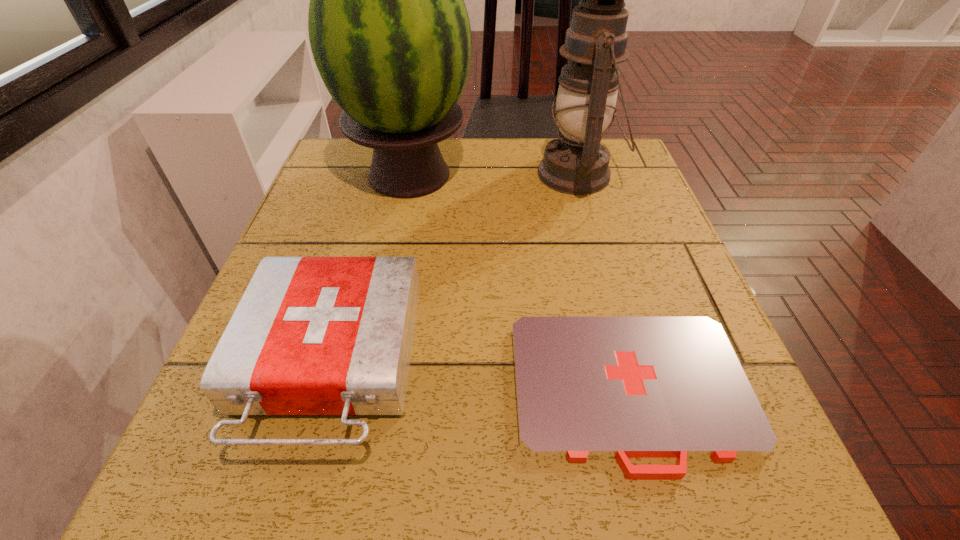
At what (x,y) coordinates should I click in order to perform the action: click on empty location between the shortest object and the oil lamp. Please return your answer as a coordinate pair (x, y). Looking at the image, I should click on (604, 283).

This screenshot has height=540, width=960. In order to click on free space between the shorter first-aid kit and the oil lamp in this screenshot , I will do `click(604, 283)`.

Where is `free space between the watermelon and the shortest object`? free space between the watermelon and the shortest object is located at coordinates (520, 284).

Find the location of a particular element. Image resolution: width=960 pixels, height=540 pixels. empty space that is in between the right first-aid kit and the oil lamp is located at coordinates (604, 283).

Identify which object is the second nearest to the shortest object. Please provide its 2D coordinates. Your answer should be formatted as a tuple, i.e. [(x, y)], where the tuple contains the x and y coordinates of a point satisfying the conditions above.

[(389, 31)]

In order to click on the third closest object to the watermelon in this screenshot , I will do `click(586, 387)`.

Where is `vacant area that satisfies the following two spatial constraints: 1. on the back side of the watermelon; 2. on the right side of the oil lamp`? This screenshot has width=960, height=540. vacant area that satisfies the following two spatial constraints: 1. on the back side of the watermelon; 2. on the right side of the oil lamp is located at coordinates (410, 174).

At what (x,y) coordinates should I click in order to perform the action: click on vacant space that satisfies the following two spatial constraints: 1. on the back side of the watermelon; 2. on the left side of the oil lamp. Please return your answer as a coordinate pair (x, y). This screenshot has height=540, width=960. Looking at the image, I should click on 410,174.